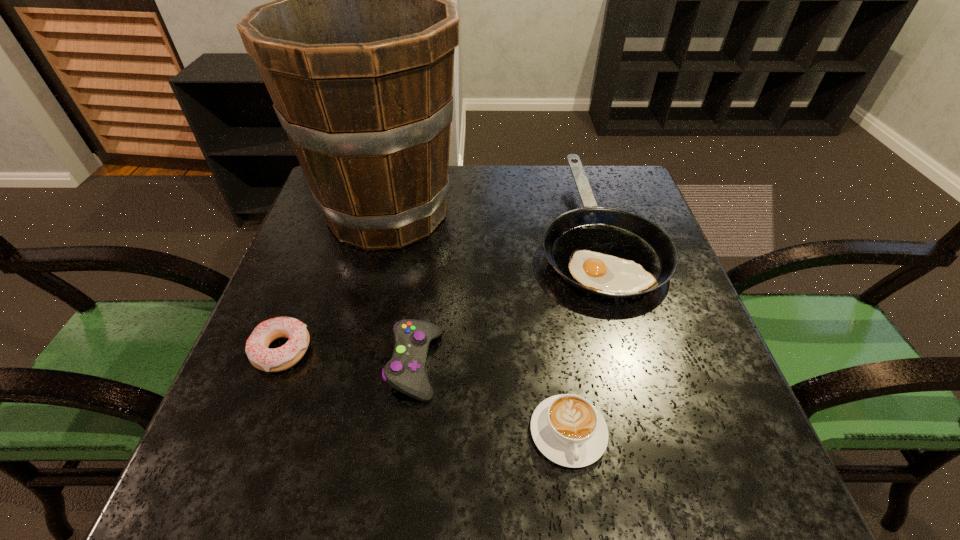
You are a GUI agent. You are given a task and a screenshot of the screen. Output one action in this format:
    pyautogui.click(x=<x>, y=<y>)
    Task: Click on the frying pan that is at the far edge
    This screenshot has width=960, height=540.
    Given the screenshot: What is the action you would take?
    pyautogui.click(x=607, y=252)

This screenshot has width=960, height=540. What are the coordinates of `object at the near edge` in the screenshot? It's located at (567, 429).

I want to click on bucket positioned at the left edge, so click(x=357, y=51).

Locate an element on the screen. doughnut that is at the left edge is located at coordinates (278, 359).

Where is `object that is at the right edge`? object that is at the right edge is located at coordinates (607, 252).

Find the location of a particular element. object that is at the far left corner is located at coordinates (357, 51).

The image size is (960, 540). I want to click on object present at the far right corner, so click(x=607, y=252).

The height and width of the screenshot is (540, 960). Find the location of `free space at the far edge of the desktop`. free space at the far edge of the desktop is located at coordinates click(x=557, y=173).

Locate an element on the screen. Image resolution: width=960 pixels, height=540 pixels. blank space at the near edge of the desktop is located at coordinates (663, 501).

Where is `free space at the left edge of the desktop`? This screenshot has width=960, height=540. free space at the left edge of the desktop is located at coordinates (280, 435).